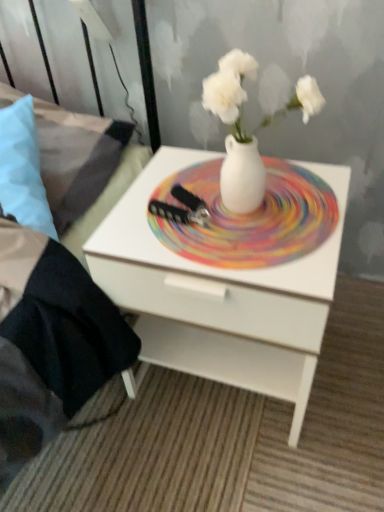
Locate an element on the screen. empty space that is ontop of white glossy nightstand at center is located at coordinates pyautogui.click(x=225, y=207).